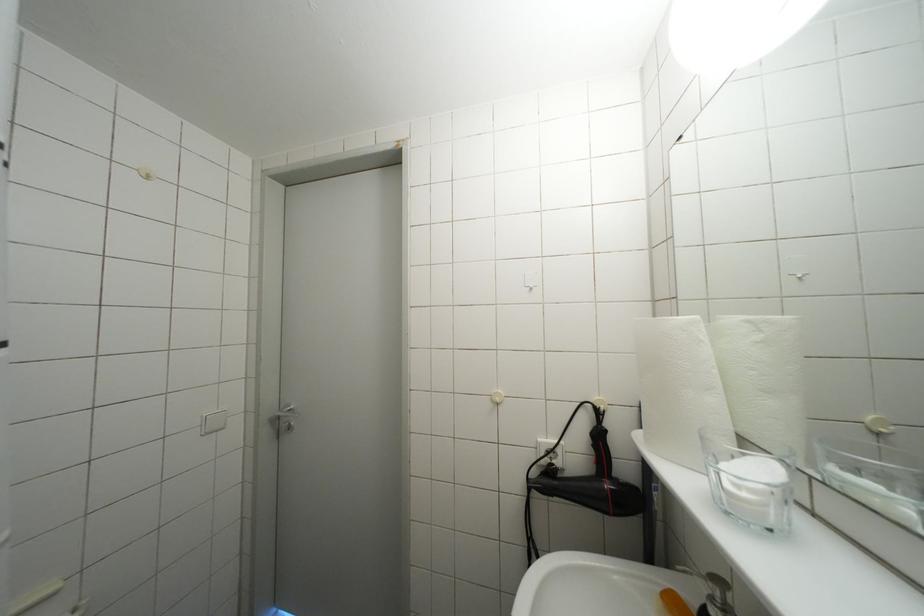
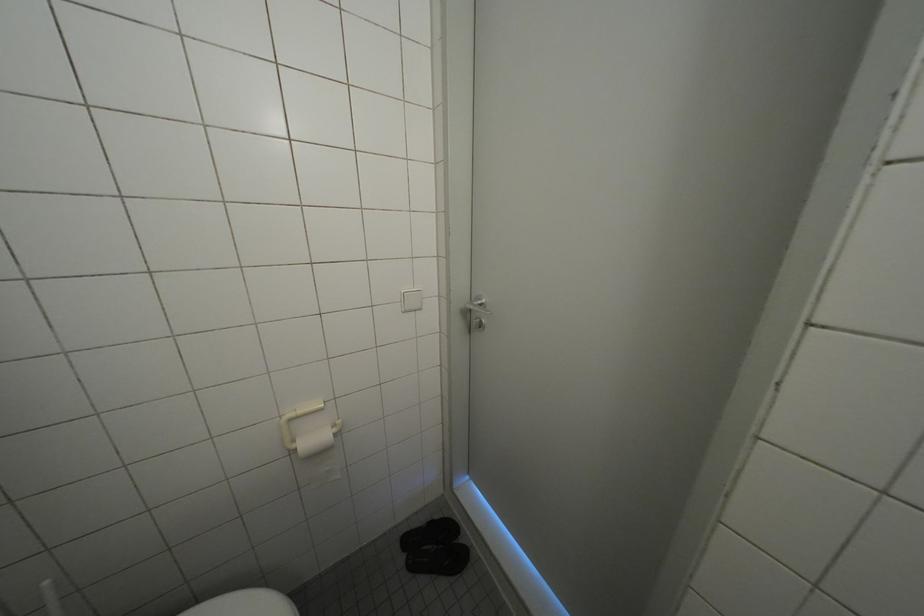
Based on the continuous images, in which direction is the camera rotating?

The camera rotated toward left-down.